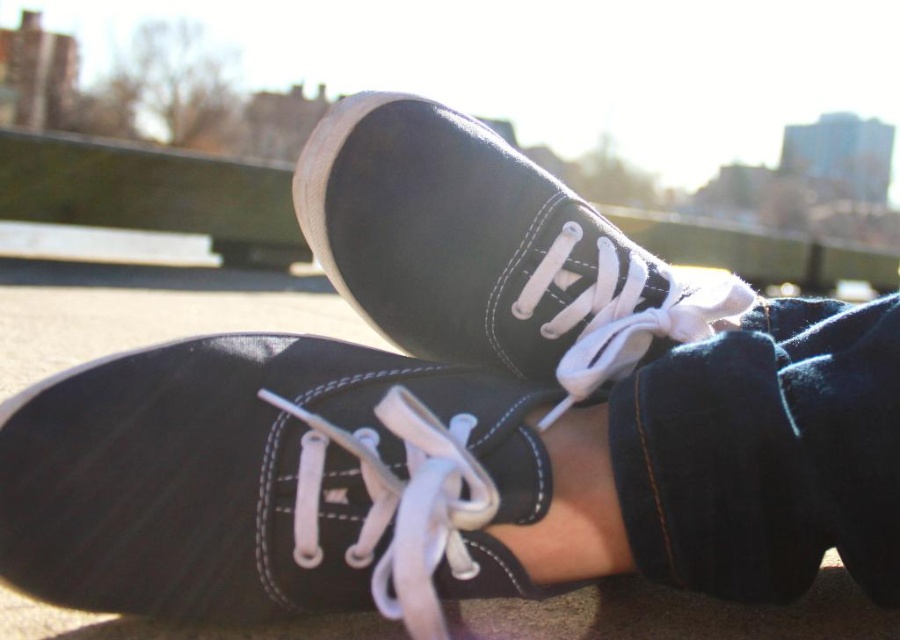
Question: Which point is farther from the camera taking this photo?

Choices:
 (A) (500, 435)
 (B) (554, 260)

Answer: (B)

Question: Is matte black shoe at center bigger than matte black sneaker at center?

Choices:
 (A) no
 (B) yes

Answer: (A)

Question: Considering the relative positions of matte black shoe at center and matte black sneaker at center in the image provided, where is matte black shoe at center located with respect to matte black sneaker at center?

Choices:
 (A) left
 (B) right

Answer: (A)

Question: Does matte black shoe at center appear on the left side of matte black sneaker at center?

Choices:
 (A) no
 (B) yes

Answer: (B)

Question: Which point appears closest to the camera in this image?

Choices:
 (A) (495, 392)
 (B) (574, 264)

Answer: (A)